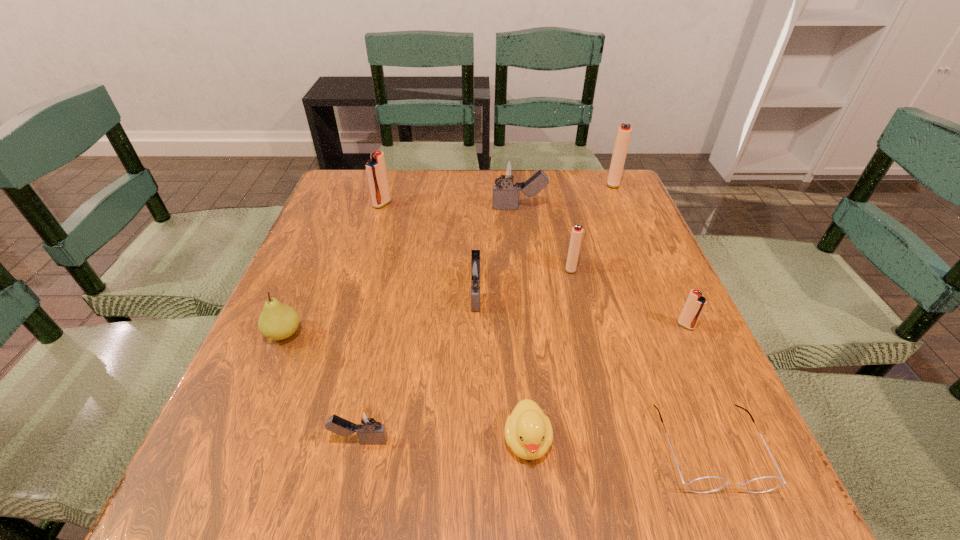
What are the coordinates of `igniter that is at the left edge` in the screenshot? It's located at (376, 169).

Where is `pear located at the left edge`? This screenshot has width=960, height=540. pear located at the left edge is located at coordinates (277, 321).

This screenshot has width=960, height=540. Find the location of `spectacles that is at the right edge`. spectacles that is at the right edge is located at coordinates (708, 484).

Identify the location of object located at the far left corner. The image size is (960, 540). (376, 169).

At what (x,y) coordinates should I click in order to perform the action: click on object at the far right corner. Please return your answer as a coordinate pair (x, y). This screenshot has width=960, height=540. Looking at the image, I should click on (624, 132).

This screenshot has height=540, width=960. I want to click on object located at the near right corner, so click(708, 484).

This screenshot has height=540, width=960. Identify the location of free location at the far edge of the desktop. (539, 194).

The width and height of the screenshot is (960, 540). In the image, there is a desktop. Find the location of `vacant space at the near edge`. vacant space at the near edge is located at coordinates (551, 492).

What are the coordinates of `blank space at the left edge of the desktop` in the screenshot? It's located at point(334,279).

The image size is (960, 540). I want to click on vacant space at the right edge of the desktop, so click(x=660, y=277).